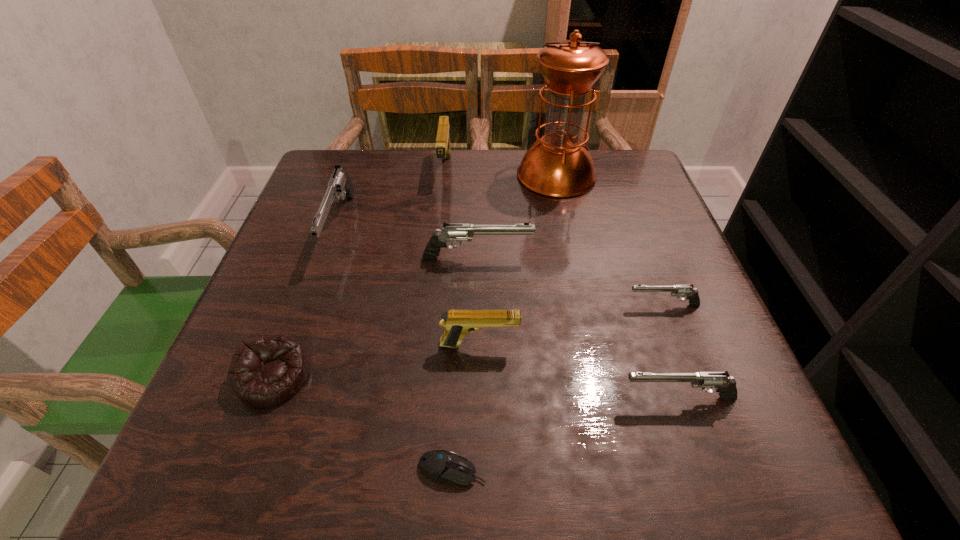
Locate an element on the screen. the second closest object to the biggest silver pistol is located at coordinates (267, 370).

Where is `pistol that is the fifth closest to the leftmost pistol`? The image size is (960, 540). pistol that is the fifth closest to the leftmost pistol is located at coordinates (726, 386).

Identify the location of pistol that stands as the third closest to the fifth nearest object. (457, 323).

Identify which silver pistol is the closest to the fifth farthest object. Please provide its 2D coordinates. Your answer should be formatted as a tuple, i.e. [(x, y)], where the tuple contains the x and y coordinates of a point satisfying the conditions above.

[(726, 386)]

What are the coordinates of `silver pistol that is the third closest one to the nearest object` in the screenshot? It's located at pos(451,232).

Identify the location of vacant area in the image that satisfies the following two spatial constraints: 1. at the barrel of the left tan pistol; 2. on the left side of the shortest object. The height and width of the screenshot is (540, 960). (415, 470).

This screenshot has height=540, width=960. I want to click on vacant space that satisfies the following two spatial constraints: 1. on the back side of the tallest object; 2. on the right side of the shortest object, so click(465, 175).

At what (x,y) coordinates should I click in order to perform the action: click on free spot that satisfies the following two spatial constraints: 1. on the front-facing side of the nearest object; 2. on the left side of the leftmost silver pistol. Please return your answer as a coordinate pair (x, y). Looking at the image, I should click on (257, 470).